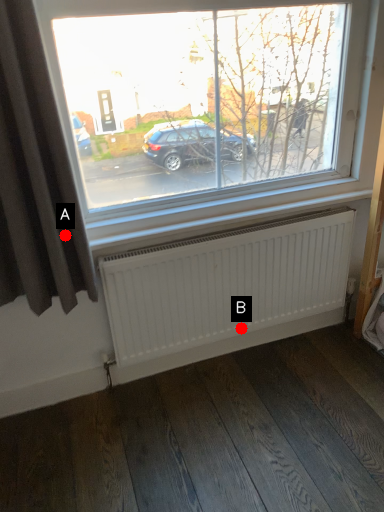
Question: Two points are circled on the image, labeled by A and B beside each circle. Which point is further to the camera?

Choices:
 (A) A is further
 (B) B is further

Answer: (B)